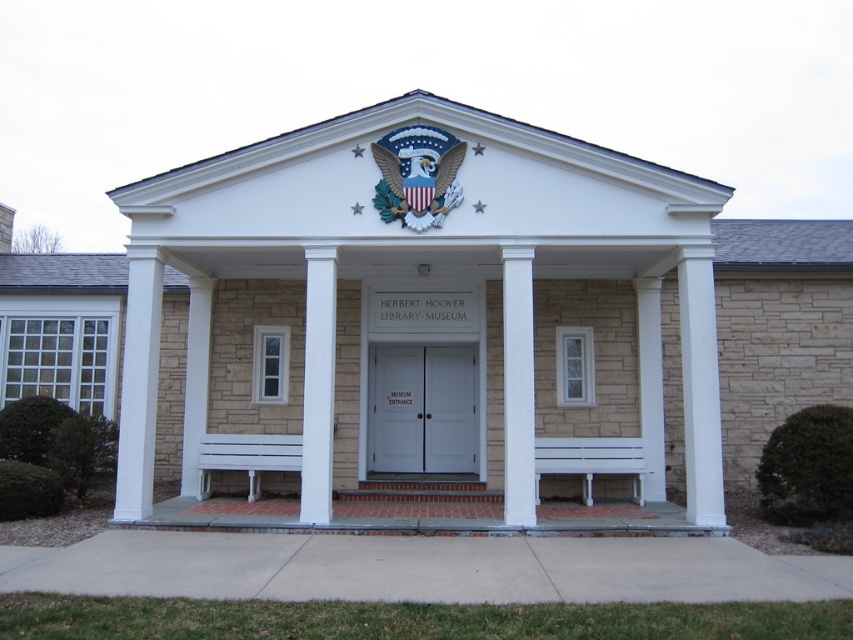
Is white smooth column at center further to camera compared to white stone column at left?

No, white smooth column at center is closer to the viewer.

Is white smooth column at center to the left of white stone column at left from the viewer's perspective?

Incorrect, white smooth column at center is not on the left side of white stone column at left.

What do you see at coordinates (518, 385) in the screenshot? I see `white smooth column at center` at bounding box center [518, 385].

You are a GUI agent. You are given a task and a screenshot of the screen. Output one action in this format:
    pyautogui.click(x=<x>, y=<y>)
    Task: Click on the white smooth column at center
    
    Given the screenshot: What is the action you would take?
    pyautogui.click(x=518, y=385)

Does white painted wood column at center appear on the left side of white stone column at left?

In fact, white painted wood column at center is to the right of white stone column at left.

Between white painted wood column at center and white stone column at left, which one is positioned lower?

Positioned lower is white stone column at left.

Between point (329, 428) and point (184, 474), which one is positioned behind?

Point (184, 474)

Where is `white painted wood column at center`? This screenshot has height=640, width=853. white painted wood column at center is located at coordinates (318, 385).

Who is shorter, white smooth column at center or white painted wood column at center?

With less height is white painted wood column at center.

Who is positioned more to the right, white smooth column at center or white painted wood column at center?

From the viewer's perspective, white smooth column at center appears more on the right side.

Is point (527, 308) closer to viewer compared to point (309, 396)?

No, (527, 308) is behind (309, 396).

Find the location of a particular element. Image resolution: width=853 pixels, height=640 pixels. white smooth column at center is located at coordinates (518, 385).